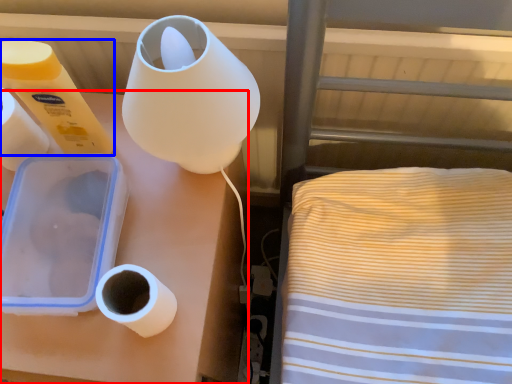
Question: Which point is closer to the camera, furniture (highlighted by a red box) or toilet paper (highlighted by a blue box)?

Choices:
 (A) furniture
 (B) toilet paper

Answer: (B)